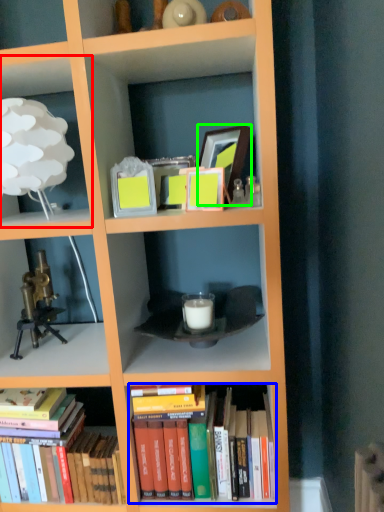
Question: Which object is the closest to the shelf (highlighted by a red box)? Choose among these: book (highlighted by a blue box) or picture frame (highlighted by a green box).

Choices:
 (A) book
 (B) picture frame

Answer: (B)